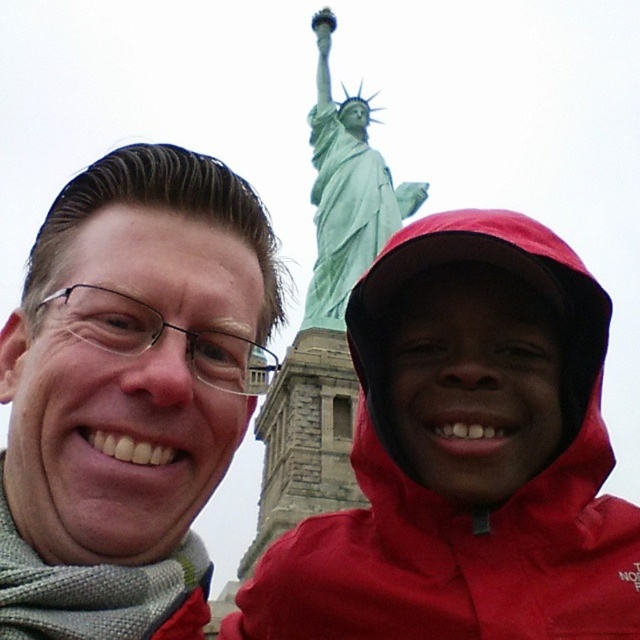
Question: In this image, where is red waterproof jacket at center located relative to green patina statue at upper center?

Choices:
 (A) below
 (B) above

Answer: (A)

Question: Can you confirm if matte black glasses at left is smaller than green patina statue at upper center?

Choices:
 (A) no
 (B) yes

Answer: (B)

Question: Does matte black glasses at left have a larger size compared to green patina statue at upper center?

Choices:
 (A) no
 (B) yes

Answer: (A)

Question: Among these points, which one is farthest from the camera?

Choices:
 (A) (323, 218)
 (B) (136, 353)
 (C) (570, 256)

Answer: (A)

Question: Which point appears closest to the camera in this image?

Choices:
 (A) (492, 573)
 (B) (352, 170)

Answer: (A)

Question: Which point is closer to the camera?

Choices:
 (A) green patina statue at upper center
 (B) red waterproof jacket at center
 (C) matte black glasses at left

Answer: (C)